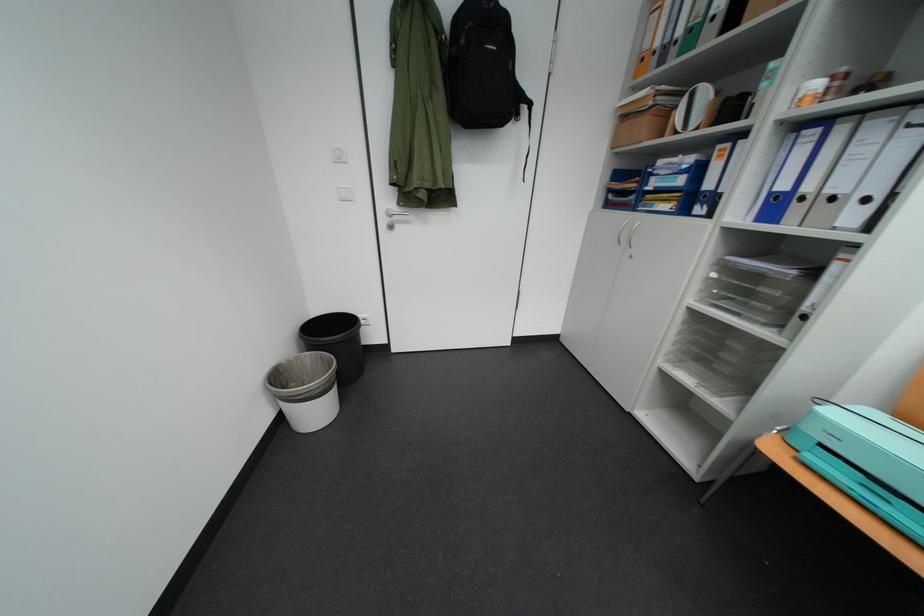
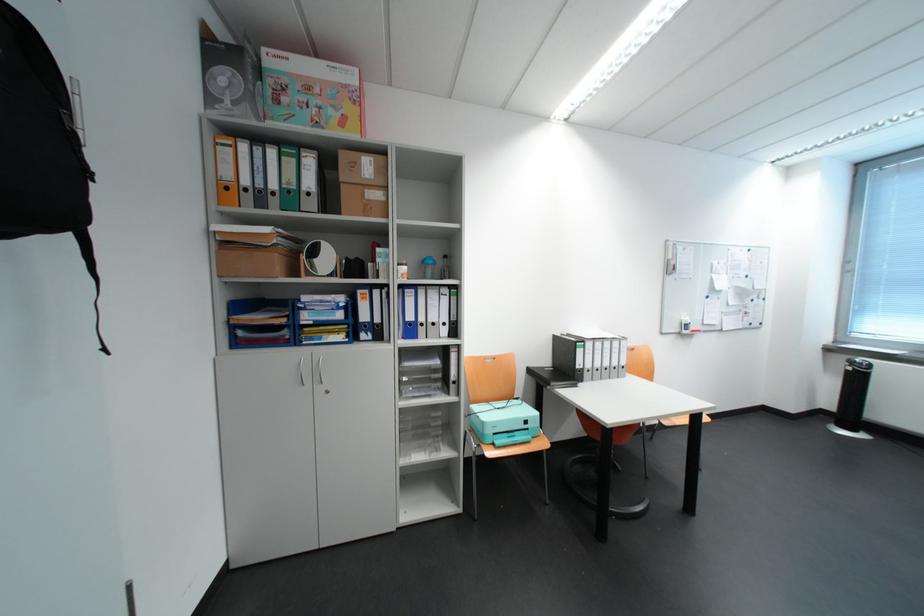
In the second image, find the point that corresponds to (782,196) in the first image.

(417, 323)